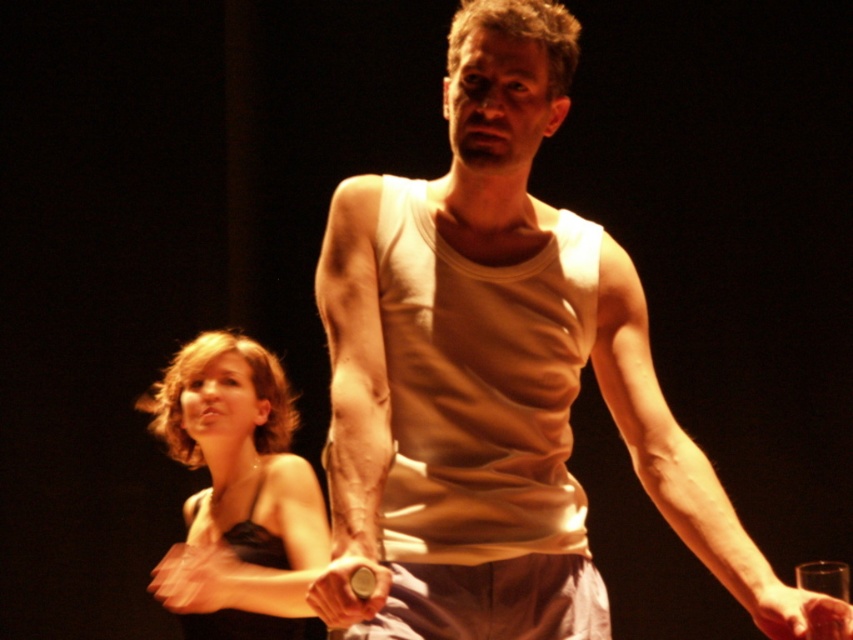
Question: Which object is positioned farthest from the smooth skin hand at lower right?

Choices:
 (A) white cotton tank top at center
 (B) matte black hand at lower left

Answer: (B)

Question: Is satin black dress at lower left bigger than smooth skin hand at lower right?

Choices:
 (A) no
 (B) yes

Answer: (B)

Question: Which of these objects is positioned closest to the satin black dress at lower left?

Choices:
 (A) matte black hand at lower left
 (B) white cotton tank top at center
 (C) matte brown stick at center
 (D) smooth skin hand at lower right

Answer: (A)

Question: Does satin black dress at lower left appear on the left side of matte brown stick at center?

Choices:
 (A) no
 (B) yes

Answer: (B)

Question: Does matte black hand at lower left lie behind smooth skin hand at lower right?

Choices:
 (A) no
 (B) yes

Answer: (B)

Question: Which point is farther from the camera taking this photo?

Choices:
 (A) (245, 465)
 (B) (387, 577)
 (C) (221, 561)

Answer: (A)